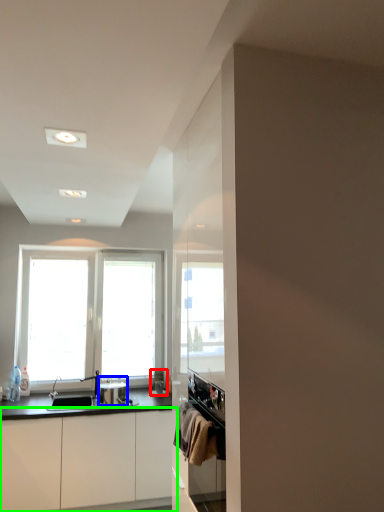
Question: Considering the real-world distances, which object is closest to appliance (highlighted by a red box)? appliance (highlighted by a blue box) or cabinetry (highlighted by a green box).

Choices:
 (A) appliance
 (B) cabinetry

Answer: (A)